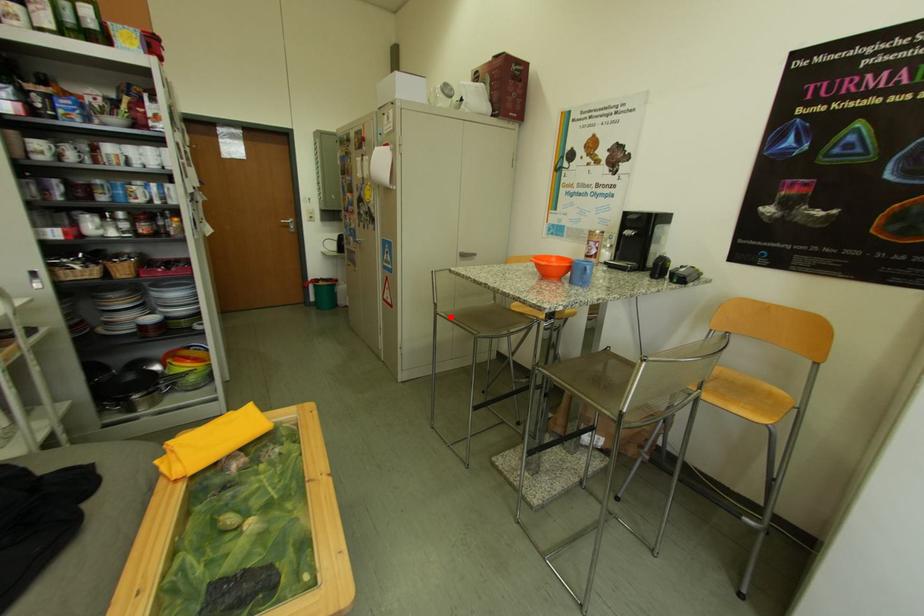
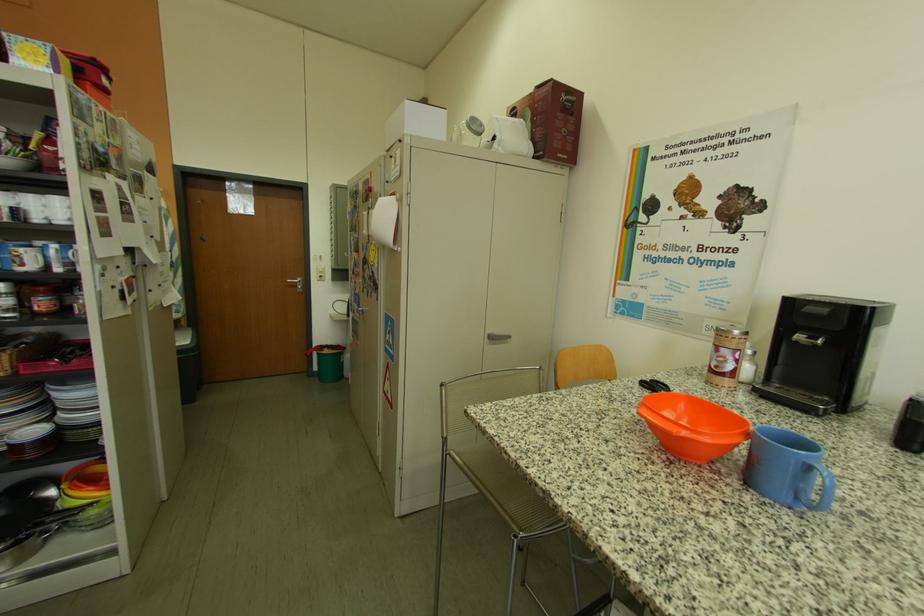
In the second image, find the point that corresponds to the highlighted location in the first image.

(460, 456)